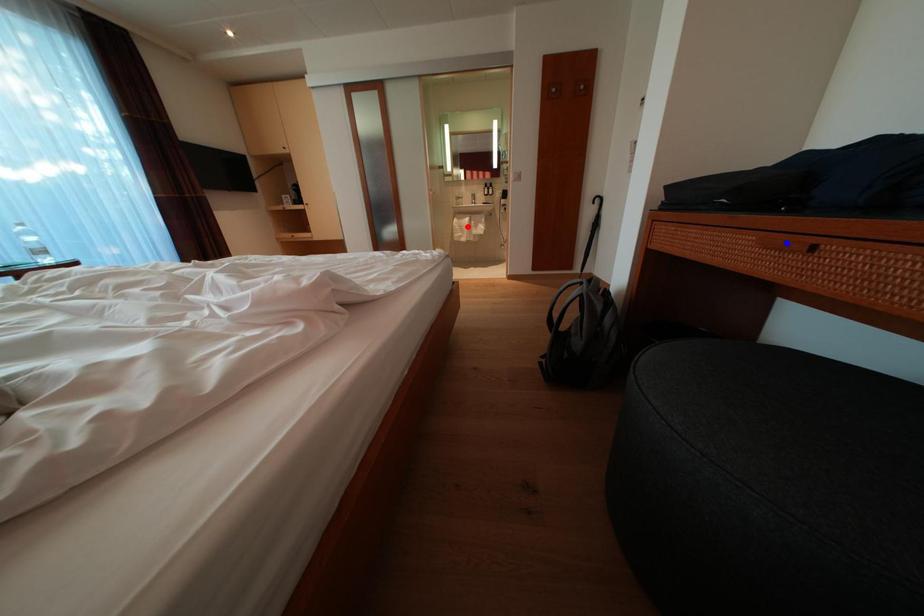
Question: In the image, two points are highlighted. Which point is nearer to the camera? Reply with the corresponding letter.

Choices:
 (A) blue point
 (B) red point

Answer: (A)